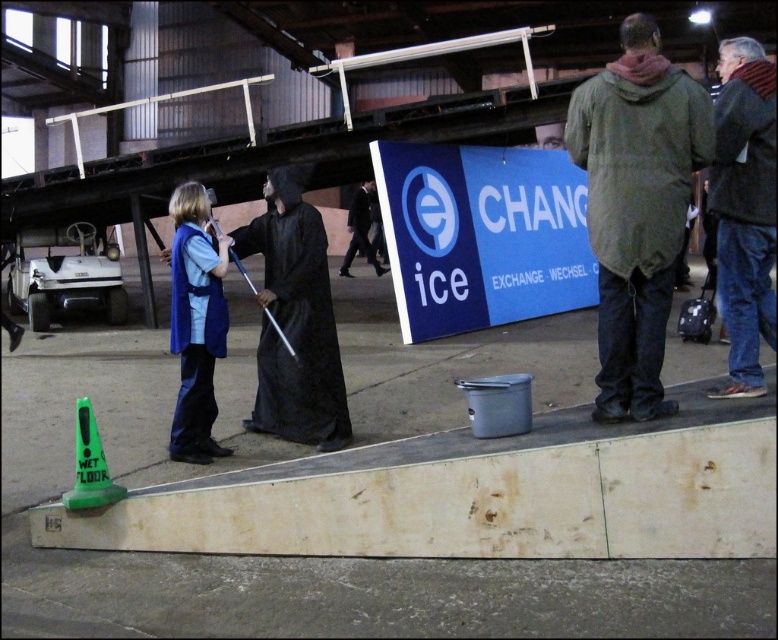
You are a GUI agent. You are given a task and a screenshot of the screen. Output one action in this format:
    pyautogui.click(x=<x>, y=<y>)
    Task: Click on the black matte robe at center
    The height and width of the screenshot is (640, 778).
    Given the screenshot: What is the action you would take?
    pyautogui.click(x=295, y=330)

Looking at this image, between black matte robe at center and green plastic cone at lower left, which one has more height?

Standing taller between the two is black matte robe at center.

Which is in front, point (338, 384) or point (90, 406)?

Positioned in front is point (90, 406).

Image resolution: width=778 pixels, height=640 pixels. Identify the location of black matte robe at center. (295, 330).

At what (x,y) coordinates should I click in order to perform the action: click on green matte raincoat at right. Please return your answer as a coordinate pair (x, y). The image size is (778, 640). Looking at the image, I should click on (636, 208).

Between point (617, 333) and point (275, 387), which one is positioned behind?

Positioned behind is point (275, 387).

Find the location of `green matte raincoat at right`. green matte raincoat at right is located at coordinates (636, 208).

Can you confirm if black matte robe at center is bigger than dark suit at center?

Actually, black matte robe at center might be smaller than dark suit at center.

Is black matte robe at center further to the viewer compared to dark suit at center?

Result: No, it is not.

Is point (324, 432) in front of point (359, 196)?

Yes, point (324, 432) is in front of point (359, 196).

At what (x,y) coordinates should I click in order to perform the action: click on black matte robe at center. Please return your answer as a coordinate pair (x, y). The image size is (778, 640). Looking at the image, I should click on (295, 330).